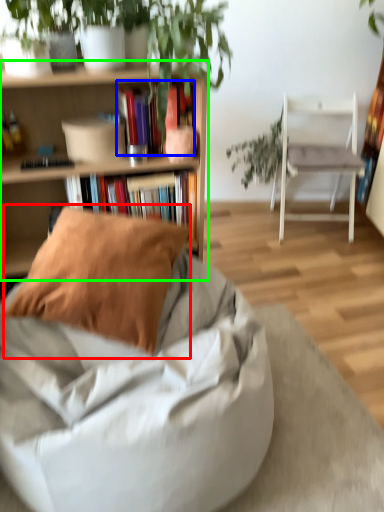
Question: Based on their relative distances, which object is farther from pillow (highlighted by a red box)? Choose from book (highlighted by a blue box) and shelf (highlighted by a green box).

Choices:
 (A) book
 (B) shelf

Answer: (A)